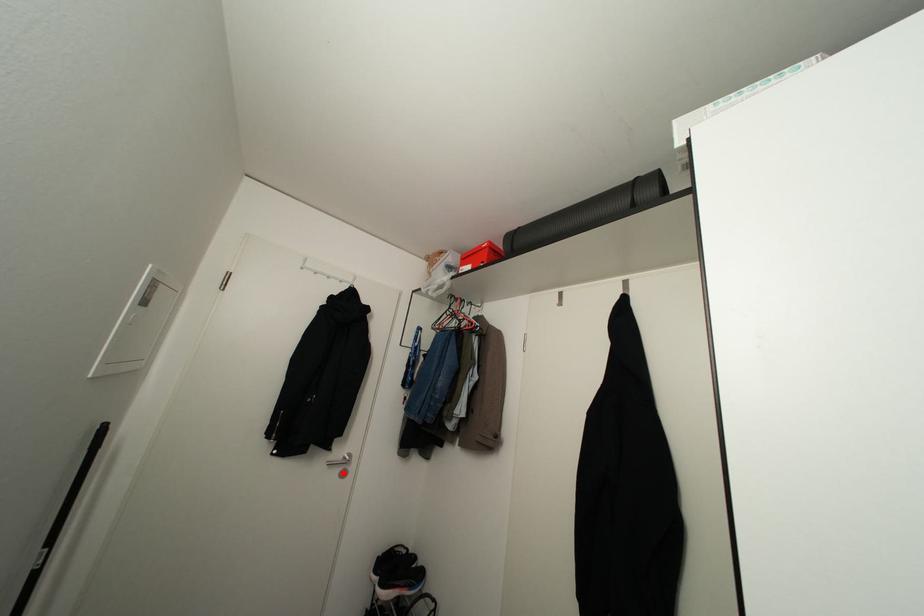
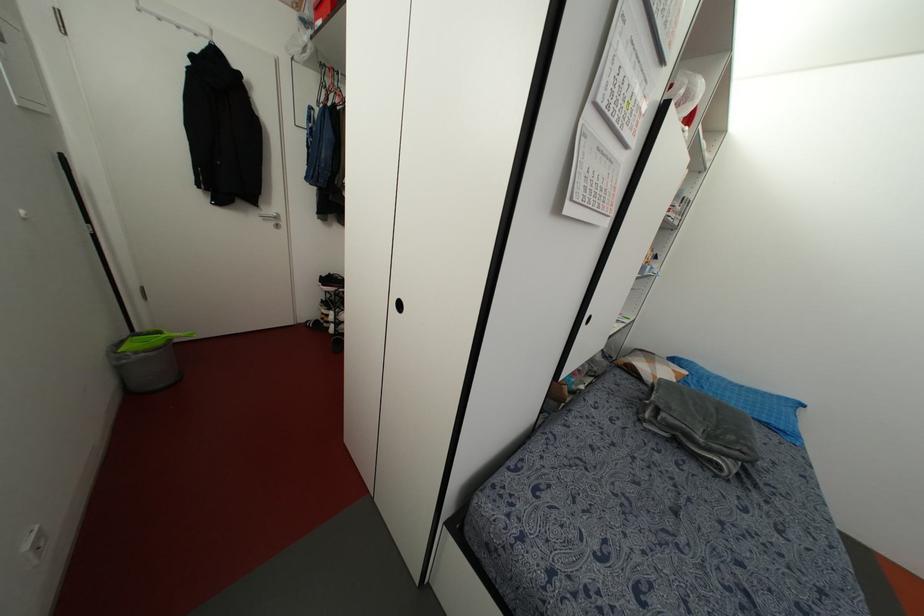
Question: I am providing you with two images of the same scene from different viewpoints. In image1, a red point is highlighted. Considering the same 3D point in image2, which of the following is correct?

Choices:
 (A) It is closer
 (B) It is farther

Answer: (A)